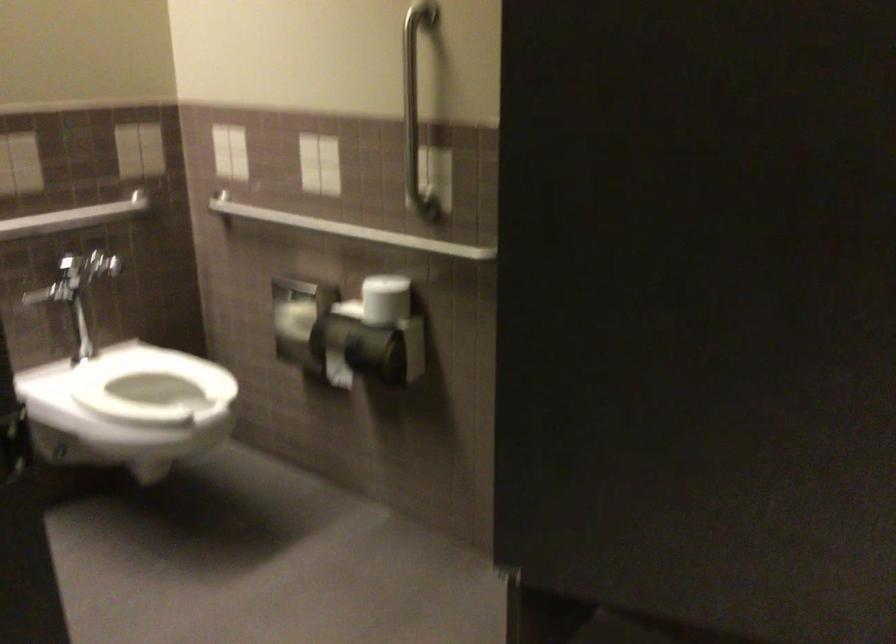
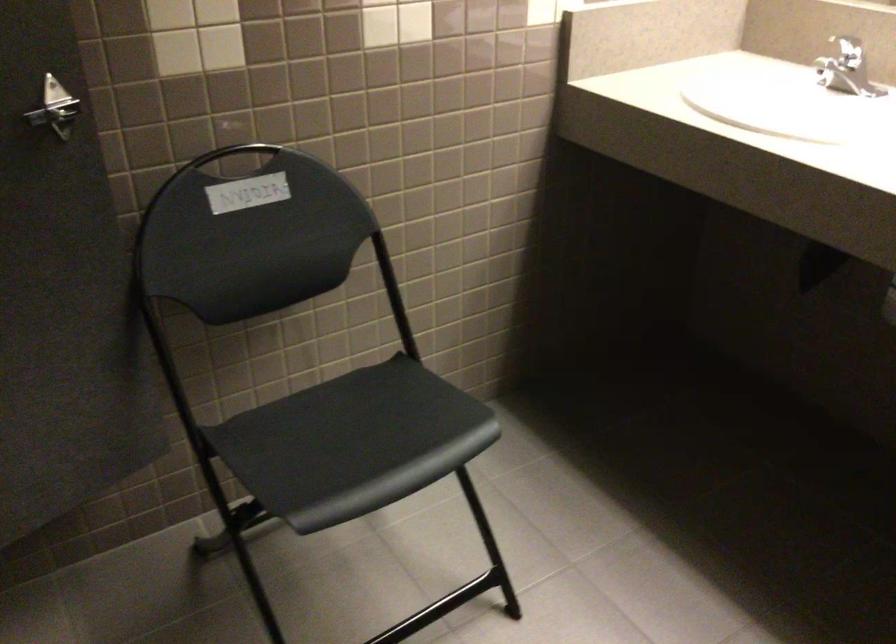
How did the camera likely rotate?

The rotation direction of the camera is right-down.